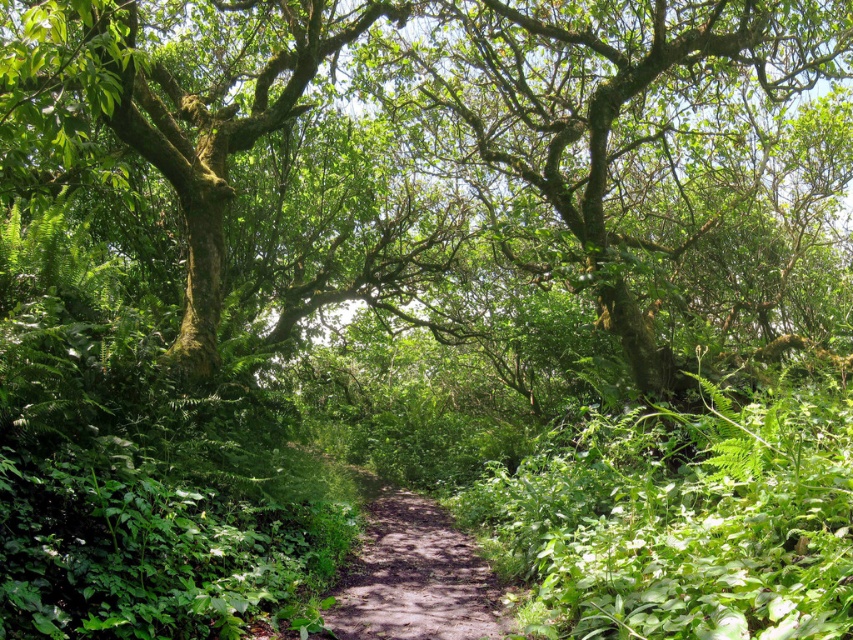
Question: Is green mossy tree at center bigger than dirt path at center?

Choices:
 (A) no
 (B) yes

Answer: (B)

Question: Is green mossy tree at center to the left of dirt path at center from the viewer's perspective?

Choices:
 (A) no
 (B) yes

Answer: (A)

Question: From the image, what is the correct spatial relationship of green mossy tree at center in relation to dirt path at center?

Choices:
 (A) right
 (B) left

Answer: (A)

Question: Which object appears closest to the camera in this image?

Choices:
 (A) green mossy tree at center
 (B) dirt path at center

Answer: (A)

Question: Which object appears farthest from the camera in this image?

Choices:
 (A) dirt path at center
 (B) green mossy tree at center

Answer: (A)